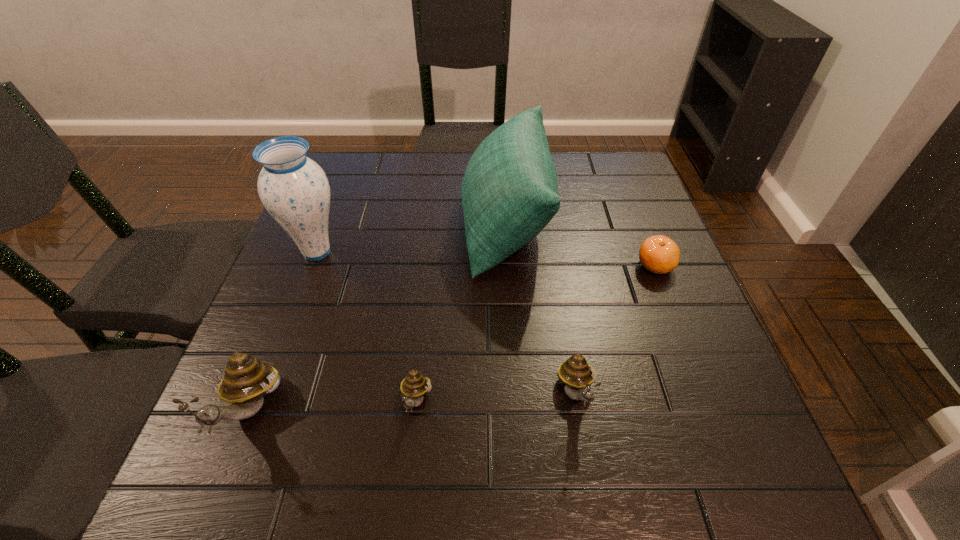
This screenshot has height=540, width=960. I want to click on free point located on the front-facing side of the second tallest object, so click(x=431, y=224).

Image resolution: width=960 pixels, height=540 pixels. Identify the location of free space located on the front-facing side of the second tallest object. [365, 224].

Where is `free location located 0.120m on the front-facing side of the second tallest object`? This screenshot has width=960, height=540. free location located 0.120m on the front-facing side of the second tallest object is located at coordinates (416, 224).

At what (x,y) coordinates should I click in order to perform the action: click on free point located on the front of the tallest object. Please return your answer as a coordinate pair (x, y). Looking at the image, I should click on (251, 427).

Locate an element on the screen. The width and height of the screenshot is (960, 540). vacant space located on the back of the shortest object is located at coordinates (632, 207).

The width and height of the screenshot is (960, 540). I want to click on object that is positioned at the far edge, so click(x=509, y=193).

Where is `snail positioned at the left edge`? snail positioned at the left edge is located at coordinates tap(246, 381).

Locate an element on the screen. Image resolution: width=960 pixels, height=540 pixels. vase that is at the left edge is located at coordinates (294, 189).

Where is `object at the right edge`? Image resolution: width=960 pixels, height=540 pixels. object at the right edge is located at coordinates (659, 254).

The width and height of the screenshot is (960, 540). Identify the location of object that is positioned at the near left corner. (246, 381).